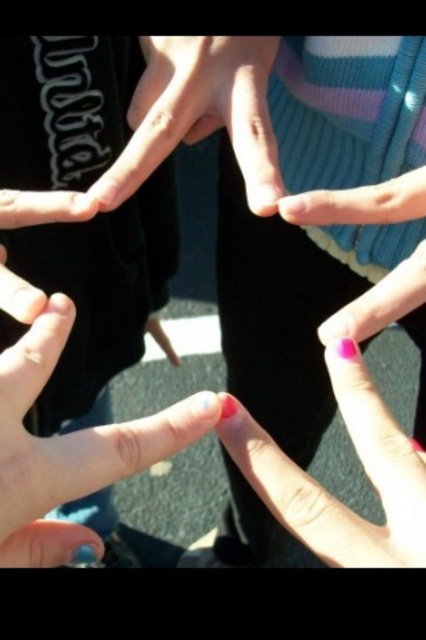
Does pink polished nail at center have a greater width compared to smooth skin hand at center?

No, pink polished nail at center is not wider than smooth skin hand at center.

Between point (402, 435) and point (193, 100), which one is positioned behind?

Positioned behind is point (193, 100).

At what (x,y) coordinates should I click in order to perform the action: click on pink polished nail at center. Please return your answer as a coordinate pair (x, y). The width and height of the screenshot is (426, 640). Looking at the image, I should click on (325, 490).

Who is lower down, smooth skin hand at lower left or smooth skin hand at center?

Positioned lower is smooth skin hand at lower left.

Consider the image. Can you confirm if smooth skin hand at lower left is bigger than smooth skin hand at center?

Actually, smooth skin hand at lower left might be smaller than smooth skin hand at center.

Between point (52, 332) and point (195, 116), which one is positioned in front?

Point (52, 332) is in front.

Image resolution: width=426 pixels, height=640 pixels. I want to click on smooth skin hand at lower left, so click(71, 449).

Is smooth skin hand at lower left further to the viewer compared to pink polished nail at center?

Yes, it is behind pink polished nail at center.

What are the coordinates of `smooth skin hand at lower left` in the screenshot? It's located at (71, 449).

Locate an element on the screen. smooth skin hand at lower left is located at coordinates (71, 449).